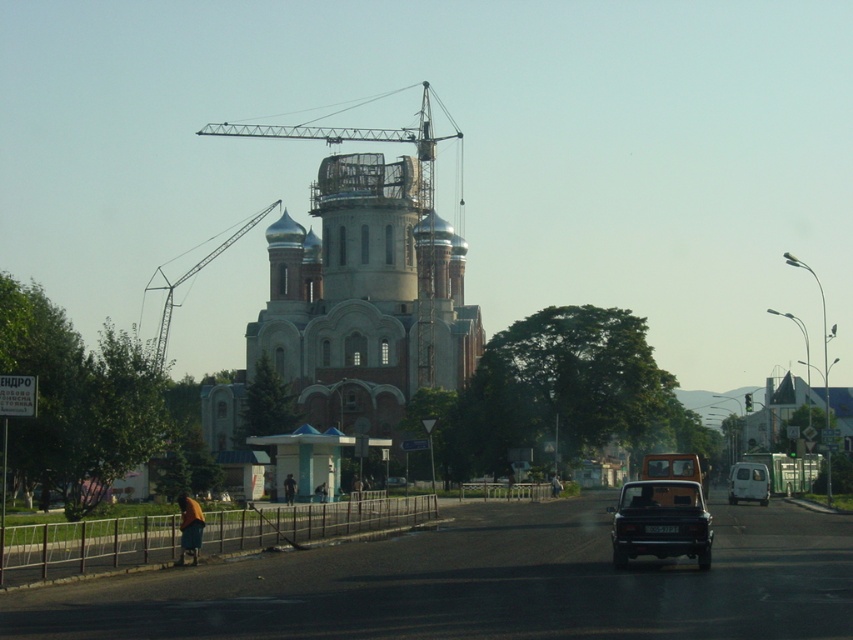
You are standing at the point with coordinates (364,284) in the image. What structure are you facing?

The point at coordinates (364,284) corresponds to the light gray stone church at center, so you are facing the light gray stone church at center.